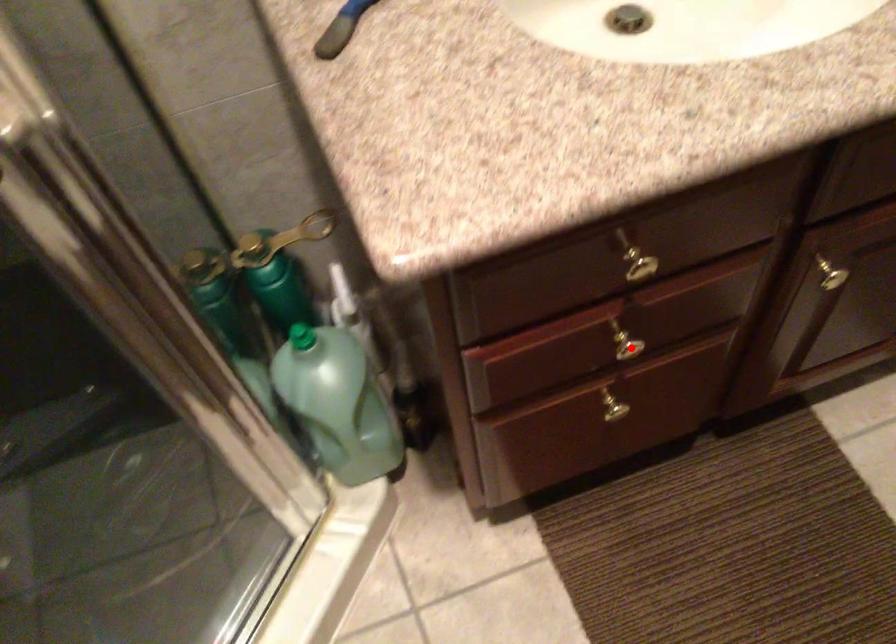
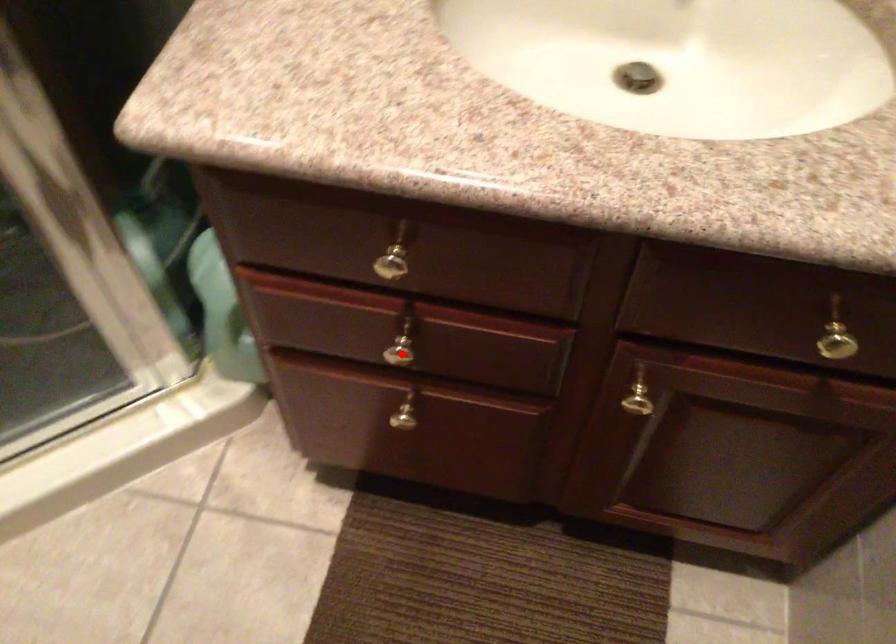
From the picture: I am providing you with two images of the same scene from different viewpoints. A red point is marked on the first image and another point is marked on the second image. Are the points marked in image1 and image2 representing the same 3D position?

Yes